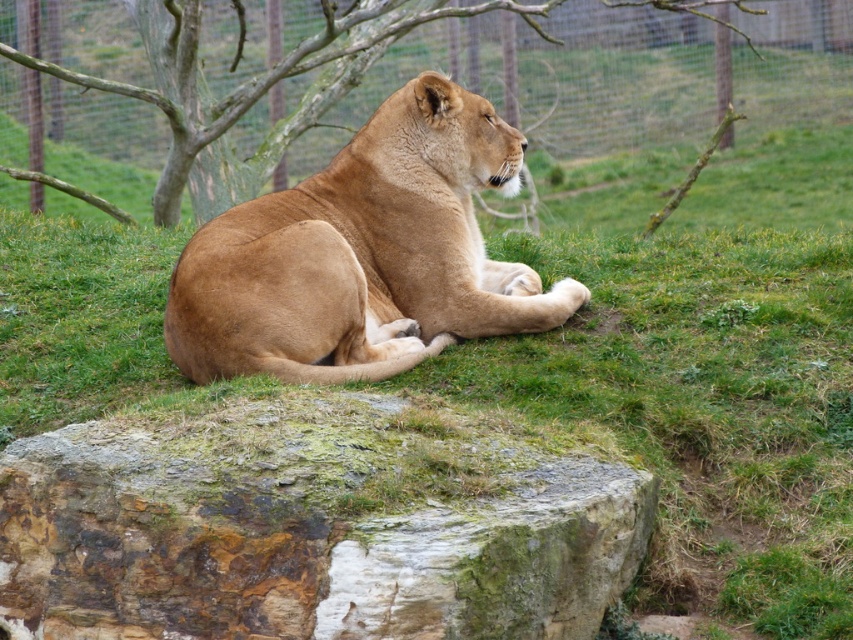
In the scene shown: You are a zookeeper observing the golden fur lion at center and the green mossy rock at lower center. Which object is closer to the left edge of the enclosure?

The green mossy rock at lower center is positioned on the left side of the golden fur lion at center, so it is closer to the left edge of the enclosure.

You are a visitor at the zoo and want to take a photo of the golden fur lion at center. However, there is a green mossy rock at lower center blocking your view. Can you move to the right or left to avoid the rock and still see the lion?

The green mossy rock at lower center is closer to the viewer than the golden fur lion at center, so moving to the right or left might help you position yourself around the rock to still see the lion.

You are a zookeeper planning to feed the golden fur lion at center and the brown bark tree at upper center. Since the tree is part of the enclosure, you need to ensure the lion can reach its food without climbing. Based on their positions, can the lion access the food placed near the tree?

The golden fur lion at center is located below the brown bark tree at upper center, so the lion can easily reach the food placed near the tree without needing to climb since it is positioned lower than the tree.